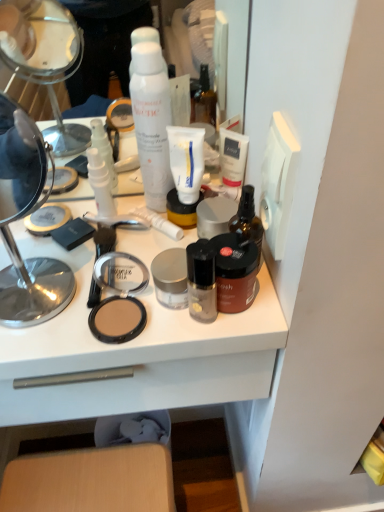
Locate an element on the screen. vacant space that is to the left of satin silver jar at center, the 3th toiletry viewed from the right is located at coordinates (59, 285).